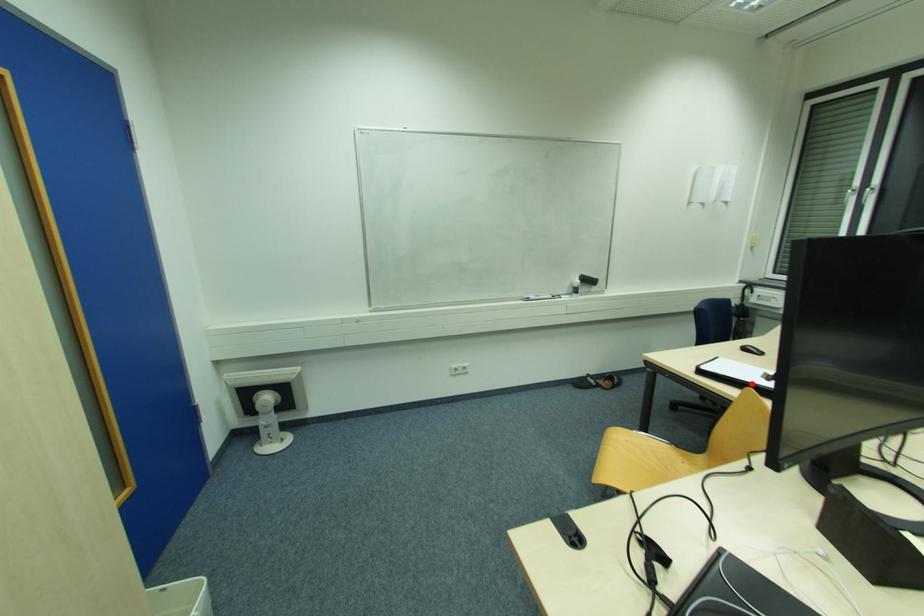
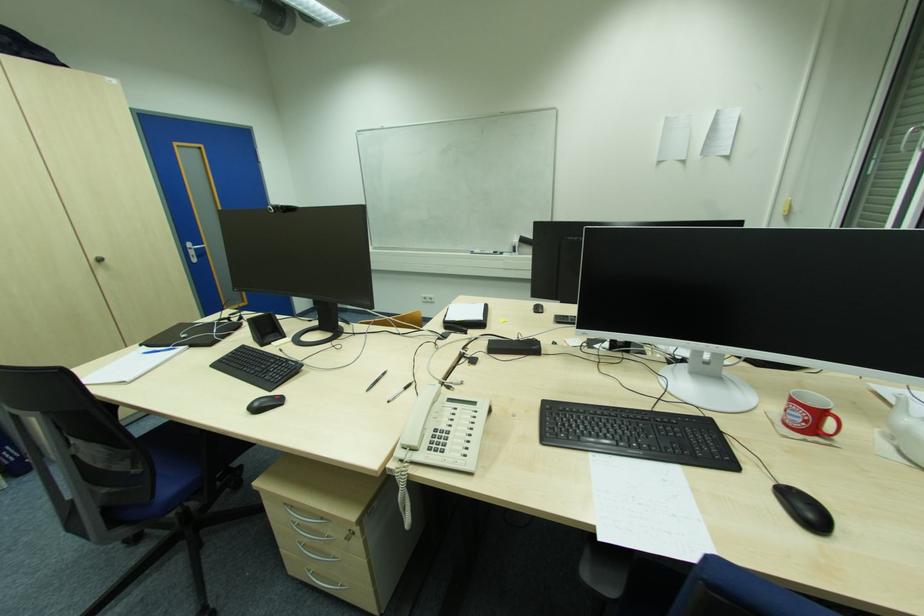
Question: I am providing you with two images of the same scene from different viewpoints. A red point is marked on the first image. Is the red point's position out of view in image 2?

Choices:
 (A) Yes
 (B) No

Answer: (A)